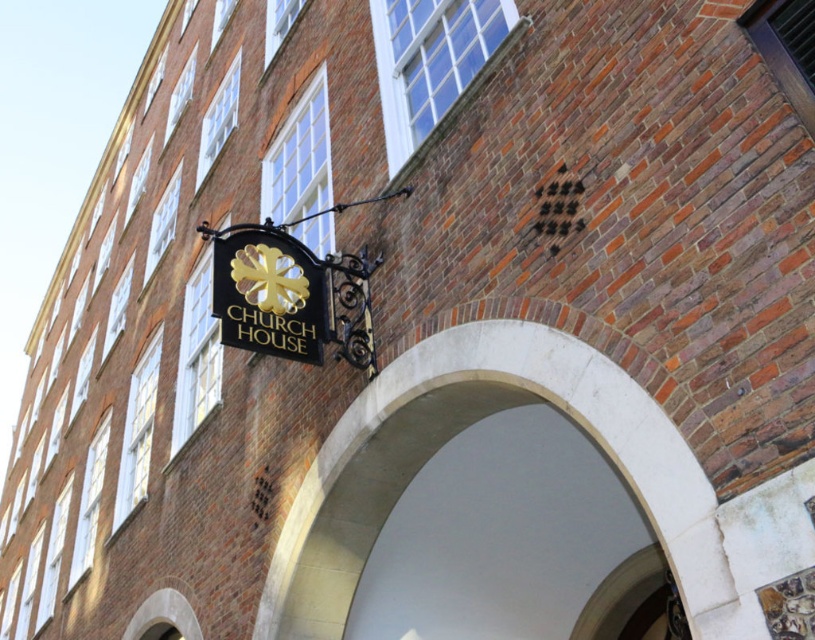
Question: Does white stone arch at center appear under gold metallic sign at center?

Choices:
 (A) yes
 (B) no

Answer: (A)

Question: Is white stone arch at center above gold metallic sign at center?

Choices:
 (A) yes
 (B) no

Answer: (B)

Question: Which point is closer to the camera taking this photo?

Choices:
 (A) (413, 422)
 (B) (280, 346)

Answer: (A)

Question: Does white stone arch at center appear over gold metallic sign at center?

Choices:
 (A) no
 (B) yes

Answer: (A)